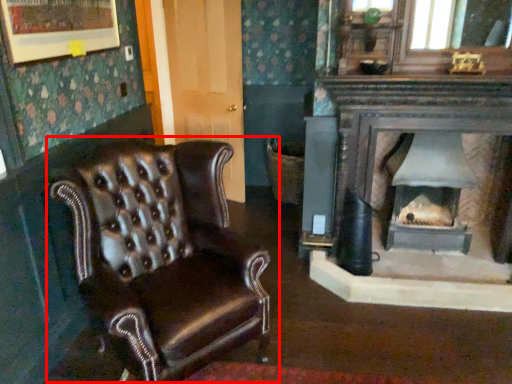
Question: Observing the image, what is the correct spatial positioning of chair (annotated by the red box) in reference to wood burning stove?

Choices:
 (A) right
 (B) left

Answer: (B)